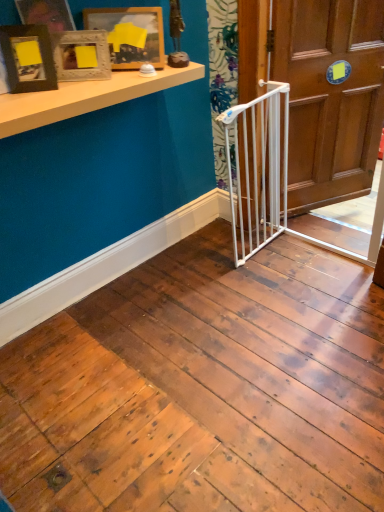
Question: Does white matte shelf at upper left have a greater width compared to white plastic gate at center?

Choices:
 (A) yes
 (B) no

Answer: (B)

Question: Is white matte shelf at upper left smaller than white plastic gate at center?

Choices:
 (A) yes
 (B) no

Answer: (A)

Question: From the image's perspective, is white matte shelf at upper left below white plastic gate at center?

Choices:
 (A) yes
 (B) no

Answer: (B)

Question: Are white matte shelf at upper left and white plastic gate at center far apart?

Choices:
 (A) no
 (B) yes

Answer: (A)

Question: Does white matte shelf at upper left have a lesser width compared to white plastic gate at center?

Choices:
 (A) no
 (B) yes

Answer: (B)

Question: From a real-world perspective, relative to matte black picture frame at upper left, the first picture frame in the front-to-back sequence, is woodenobject at upper left, which appears as the 2th picture frame when viewed from the back, vertically above or below?

Choices:
 (A) below
 (B) above

Answer: (A)

Question: Does point pyautogui.click(x=84, y=74) appear closer or farther from the camera than point pyautogui.click(x=34, y=75)?

Choices:
 (A) closer
 (B) farther

Answer: (B)

Question: In the image, is woodenobject at upper left, which appears as the 2th picture frame when viewed from the back, positioned in front of or behind matte black picture frame at upper left, the first picture frame in the front-to-back sequence?

Choices:
 (A) behind
 (B) front

Answer: (A)

Question: From the image's perspective, relative to matte black picture frame at upper left, the first picture frame in the front-to-back sequence, is woodenobject at upper left, placed as the 2th picture frame when sorted from front to back, above or below?

Choices:
 (A) below
 (B) above

Answer: (B)

Question: Based on their sizes in the image, would you say matte wooden picture frame at upper left, the third picture frame when ordered from front to back, is bigger or smaller than white plastic gate at center?

Choices:
 (A) small
 (B) big

Answer: (A)

Question: From the image's perspective, is matte wooden picture frame at upper left, which is the first picture frame from back to front, positioned above or below white plastic gate at center?

Choices:
 (A) below
 (B) above

Answer: (B)

Question: In the image, is matte wooden picture frame at upper left, the third picture frame when ordered from front to back, on the left side or the right side of white plastic gate at center?

Choices:
 (A) left
 (B) right

Answer: (A)

Question: Looking at their shapes, would you say matte wooden picture frame at upper left, the third picture frame when ordered from front to back, is wider or thinner than white plastic gate at center?

Choices:
 (A) wide
 (B) thin

Answer: (B)

Question: Would you say matte wooden picture frame at upper left, the third picture frame when ordered from front to back, is to the left or to the right of white wooden door at center in the picture?

Choices:
 (A) right
 (B) left

Answer: (B)

Question: From a real-world perspective, is matte wooden picture frame at upper left, the third picture frame when ordered from front to back, physically located above or below white wooden door at center?

Choices:
 (A) below
 (B) above

Answer: (B)